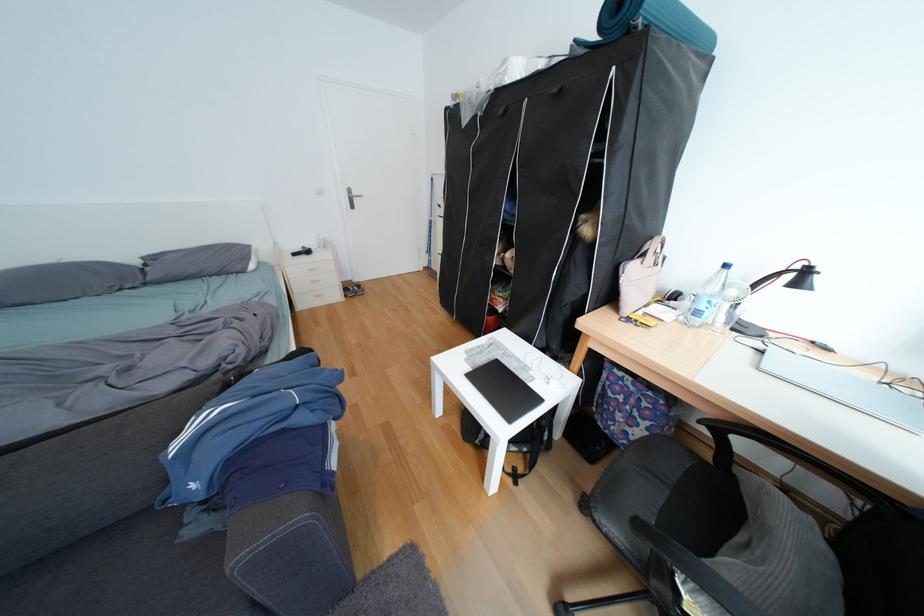
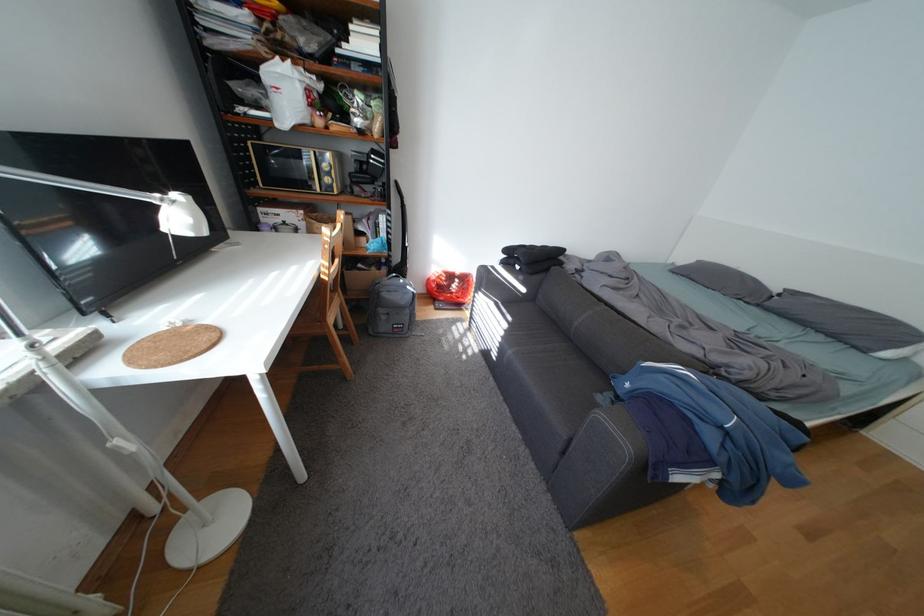
Based on the continuous images, in which direction is the camera rotating?

The camera's rotation is toward left-down.